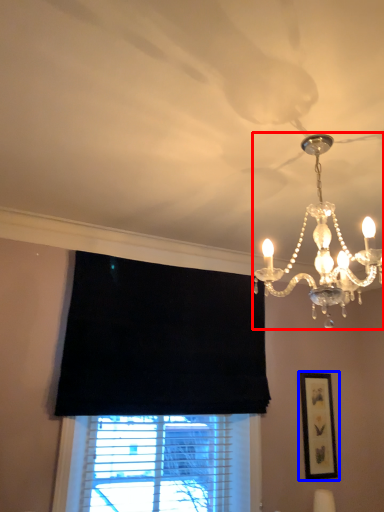
Question: Which object is closer to the camera taking this photo, lamp (highlighted by a red box) or picture frame (highlighted by a blue box)?

Choices:
 (A) lamp
 (B) picture frame

Answer: (A)